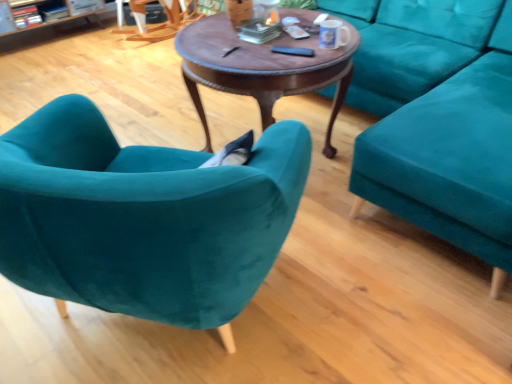
What are the coordinates of `free region on the left part of white glossy mug at upper center` in the screenshot? It's located at (293, 50).